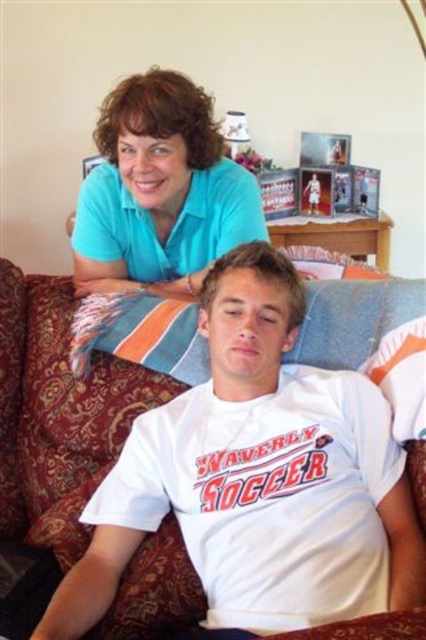
You are a furniture designer examining the image of two people sitting on a couch. The couch is marked by the point at coordinates [57,413]. Based on the scene description, what material does the couch at this point have?

The couch at point [57,413] has a velvet material.